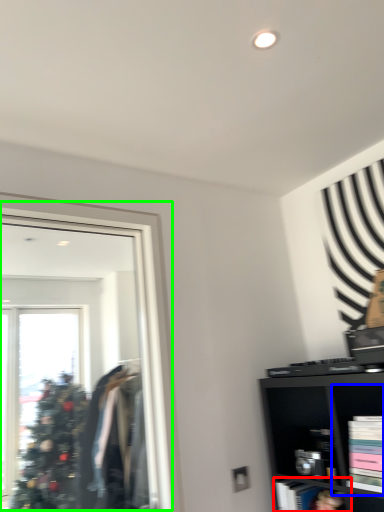
Question: Considering the real-world distances, which object is closest to cabinet (highlighted by a red box)? cabinet (highlighted by a blue box) or mirror (highlighted by a green box).

Choices:
 (A) cabinet
 (B) mirror

Answer: (A)